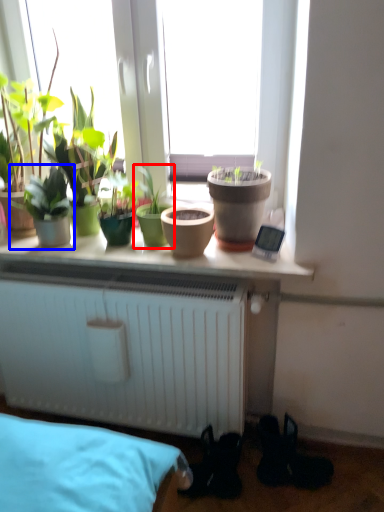
Question: Among these objects, which one is farthest to the camera, houseplant (highlighted by a red box) or houseplant (highlighted by a blue box)?

Choices:
 (A) houseplant
 (B) houseplant

Answer: (A)